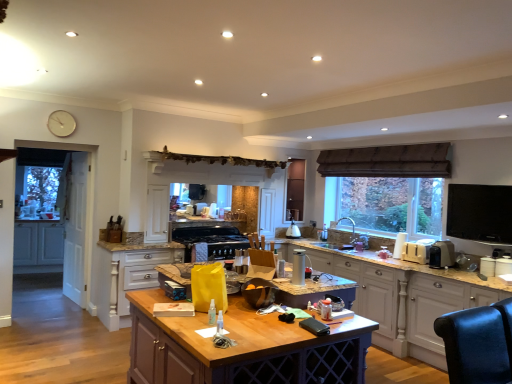
Question: Is white wood drawers at center, the second cabinetry from the back, bigger or smaller than wooden table at center?

Choices:
 (A) big
 (B) small

Answer: (B)

Question: Is white wood drawers at center, the second cabinetry from the back, in front of or behind wooden table at center in the image?

Choices:
 (A) front
 (B) behind

Answer: (B)

Question: Which object is positioned closest to the brown fabric exhaust hood at upper center?

Choices:
 (A) matte white cabinets at left, which is the 3th cabinetry in front-to-back order
 (B) black plastic toaster at right, acting as the second appliance starting from the front
 (C) white plastic toaster at right, which is the third appliance from front to back
 (D) white wooden screen door at left, the second screen door positioned from the back
 (E) black glass stove at center, the 4th appliance viewed from the front

Answer: (C)

Question: Which object is positioned closest to the white plastic toaster at right, which is the 2th appliance in right-to-left order?

Choices:
 (A) matte white cabinets at left, the 1th cabinetry viewed from the back
 (B) white matte clock at upper left
 (C) black plastic toaster at right, the third appliance viewed from the back
 (D) wooden table at center
 (E) white wood cabinetry at right, placed as the third cabinetry when sorted from back to front

Answer: (C)